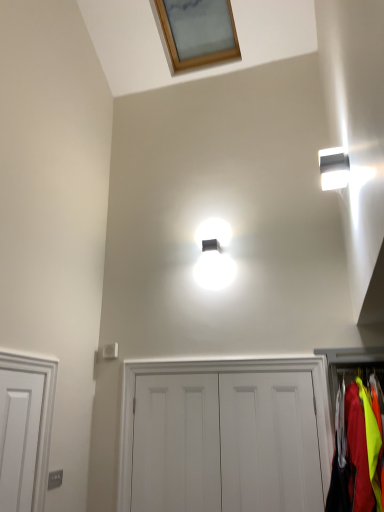
Measure the distance between neon yellow fabric at right and camera.

neon yellow fabric at right and camera are 2.22 meters apart.

Image resolution: width=384 pixels, height=512 pixels. Describe the element at coordinates (356, 453) in the screenshot. I see `neon yellow fabric at right` at that location.

Measure the distance between point [190,378] and camera.

They are 3.31 meters apart.

You are a GUI agent. You are given a task and a screenshot of the screen. Output one action in this format:
    pyautogui.click(x=<x>, y=<y>)
    Task: Click on the neon yellow fabric at right
    
    Given the screenshot: What is the action you would take?
    [x=356, y=453]

From a real-world perspective, who is located lower, white matte door at center, which is counted as the third door, starting from the left, or neon yellow fabric at right?

In real-world perspective, white matte door at center, which is counted as the third door, starting from the left, is lower.

Does point (300, 438) lie in front of point (365, 473)?

No, it is behind (365, 473).

Looking at this image, considering the sizes of objects white matte door at center, which is the 1th door in right-to-left order, and neon yellow fabric at right in the image provided, who is thinner, white matte door at center, which is the 1th door in right-to-left order, or neon yellow fabric at right?

white matte door at center, which is the 1th door in right-to-left order, is thinner.

Locate an element on the screen. Image resolution: width=384 pixels, height=512 pixels. the 1st door counting from the left side of the neon yellow fabric at right is located at coordinates (269, 442).

Is white glossy light fixture at upper right touching wooden frame at upper center?

white glossy light fixture at upper right is not next to wooden frame at upper center, and they're not touching.

What's the angular difference between white glossy light fixture at upper right and wooden frame at upper center's facing directions?

They differ by 90.6 degrees in their facing directions.

From the image's perspective, is white glossy light fixture at upper right positioned above or below wooden frame at upper center?

From the image's perspective, white glossy light fixture at upper right appears below wooden frame at upper center.

Is white glossy light fixture at upper right thinner than wooden frame at upper center?

Yes, white glossy light fixture at upper right is thinner than wooden frame at upper center.

Considering the relative sizes of white glossy light fixture at upper right and white matte door at center, acting as the 2th door starting from the left, in the image provided, is white glossy light fixture at upper right thinner than white matte door at center, acting as the 2th door starting from the left,?

Incorrect, the width of white glossy light fixture at upper right is not less than that of white matte door at center, acting as the 2th door starting from the left.

Which object is positioned more to the right, white glossy light fixture at upper right or white matte door at center, acting as the 2th door starting from the left?

From the viewer's perspective, white glossy light fixture at upper right appears more on the right side.

From the image's perspective, which one is positioned lower, white glossy light fixture at upper right or white matte door at center, acting as the 2th door starting from the right?

From the image's view, white matte door at center, acting as the 2th door starting from the right, is below.

From a real-world perspective, between white glossy light fixture at upper right and white matte door at center, acting as the 2th door starting from the left, who is vertically higher?

From a 3D spatial view, white glossy light fixture at upper right is above.

Considering the sizes of objects white matte door at center, which is the 1th door in right-to-left order, and white matte door at center, acting as the third door starting from the right, in the image provided, who is thinner, white matte door at center, which is the 1th door in right-to-left order, or white matte door at center, acting as the third door starting from the right,?

white matte door at center, which is the 1th door in right-to-left order.

Are white matte door at center, which is the 1th door in right-to-left order, and white matte door at center, the 1th door when ordered from left to right, beside each other?

No, white matte door at center, which is the 1th door in right-to-left order, is not touching white matte door at center, the 1th door when ordered from left to right.

From a real-world perspective, is white matte door at center, which is the 1th door in right-to-left order, positioned under white matte door at center, the 1th door when ordered from left to right, based on gravity?

Actually, white matte door at center, which is the 1th door in right-to-left order, is physically above white matte door at center, the 1th door when ordered from left to right, in the real world.

How much distance is there between white matte door at center, which is the 1th door in right-to-left order, and white matte door at center, the 1th door when ordered from left to right?

14.49 inches.

Between white matte door at center, acting as the 2th door starting from the right, and white matte door at center, the 1th door when ordered from left to right, which one appears on the left side from the viewer's perspective?

From the viewer's perspective, white matte door at center, the 1th door when ordered from left to right, appears more on the left side.

How distant is white matte door at center, acting as the 2th door starting from the right, from white matte door at center, acting as the third door starting from the right?

A distance of 11.95 inches exists between white matte door at center, acting as the 2th door starting from the right, and white matte door at center, acting as the third door starting from the right.

Between white matte door at center, acting as the 2th door starting from the right, and white matte door at center, acting as the third door starting from the right, which one is positioned behind?

Positioned behind is white matte door at center, acting as the third door starting from the right.

From a real-world perspective, between white matte door at center, acting as the 2th door starting from the left, and white matte door at center, the 1th door when ordered from left to right, who is vertically higher?

From a 3D spatial view, white matte door at center, acting as the 2th door starting from the left, is above.

Is white matte door at center, the 1th door when ordered from left to right, to the left of white matte door at center, which is counted as the third door, starting from the left, from the viewer's perspective?

Correct, you'll find white matte door at center, the 1th door when ordered from left to right, to the left of white matte door at center, which is counted as the third door, starting from the left.

From a real-world perspective, between white matte door at center, acting as the third door starting from the right, and white matte door at center, which is counted as the third door, starting from the left, who is vertically higher?

In real-world perspective, white matte door at center, which is counted as the third door, starting from the left, is above.

Who is shorter, white matte door at center, the 1th door when ordered from left to right, or white matte door at center, which is the 1th door in right-to-left order?

Standing shorter between the two is white matte door at center, which is the 1th door in right-to-left order.

Is neon yellow fabric at right facing towards white glossy light fixture at upper right?

No, neon yellow fabric at right is not oriented towards white glossy light fixture at upper right.

Does neon yellow fabric at right lie behind white glossy light fixture at upper right?

No, it is in front of white glossy light fixture at upper right.

How many degrees apart are the facing directions of neon yellow fabric at right and white glossy light fixture at upper right?

They differ by 86 degrees in their facing directions.

From the image's perspective, would you say neon yellow fabric at right is positioned over white glossy light fixture at upper right?

No, from the image's perspective, neon yellow fabric at right is not over white glossy light fixture at upper right.

Identify the location of the 1st door counting from the left side of the neon yellow fabric at right. (269, 442).

Identify the location of light fixture in front of the wooden frame at upper center. (334, 168).

Looking at the image, which one is located closer to wooden frame at upper center, white matte door at center, acting as the third door starting from the right, or white matte door at center, which is the 1th door in right-to-left order?

The object closer to wooden frame at upper center is white matte door at center, which is the 1th door in right-to-left order.

Considering their positions, is white glossy light fixture at upper right positioned closer to neon yellow fabric at right than wooden frame at upper center?

white glossy light fixture at upper right is closer to neon yellow fabric at right.

Considering their positions, is white matte door at center, acting as the 2th door starting from the right, positioned further to white glossy light fixture at upper right than neon yellow fabric at right?

The object further to white glossy light fixture at upper right is white matte door at center, acting as the 2th door starting from the right.

Considering their positions, is white matte door at center, which is the 1th door in right-to-left order, positioned further to white matte door at center, acting as the 2th door starting from the right, than white matte door at center, the 1th door when ordered from left to right?

white matte door at center, the 1th door when ordered from left to right.

Looking at the image, which one is located further to white matte door at center, acting as the third door starting from the right, white glossy light fixture at upper right or wooden frame at upper center?

wooden frame at upper center lies further to white matte door at center, acting as the third door starting from the right, than the other object.

Based on their spatial positions, is white matte door at center, acting as the 2th door starting from the left, or wooden frame at upper center closer to white matte door at center, acting as the third door starting from the right?

white matte door at center, acting as the 2th door starting from the left, lies closer to white matte door at center, acting as the third door starting from the right, than the other object.

Estimate the real-world distances between objects in this image. Which object is further from neon yellow fabric at right, wooden frame at upper center or white glossy light fixture at upper right?

Among the two, wooden frame at upper center is located further to neon yellow fabric at right.

When comparing their distances from white glossy light fixture at upper right, does white matte door at center, acting as the 2th door starting from the right, or white matte door at center, the 1th door when ordered from left to right, seem further?

Among the two, white matte door at center, the 1th door when ordered from left to right, is located further to white glossy light fixture at upper right.

The width and height of the screenshot is (384, 512). In order to click on clothing that lies between wooden frame at upper center and white matte door at center, acting as the 2th door starting from the left, from top to bottom in this screenshot , I will do `click(356, 453)`.

This screenshot has width=384, height=512. Identify the location of clothing between wooden frame at upper center and white matte door at center, which is counted as the third door, starting from the left, from top to bottom. (356, 453).

Identify the location of clothing between white glossy light fixture at upper right and white matte door at center, acting as the 2th door starting from the left, from top to bottom. (356, 453).

Find the location of a particular element. clothing between wooden frame at upper center and white matte door at center, the 1th door when ordered from left to right, from top to bottom is located at coordinates (356, 453).